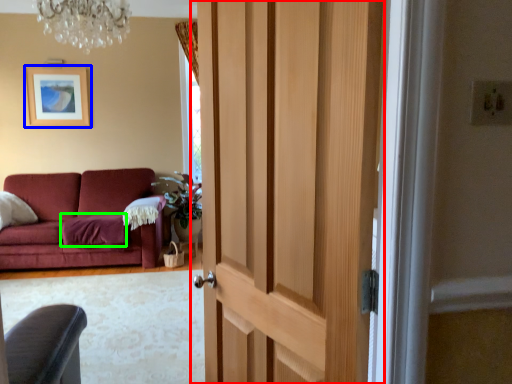
Question: Considering the real-world distances, which object is closest to door (highlighted by a red box)? picture frame (highlighted by a blue box) or blanket (highlighted by a green box).

Choices:
 (A) picture frame
 (B) blanket

Answer: (B)